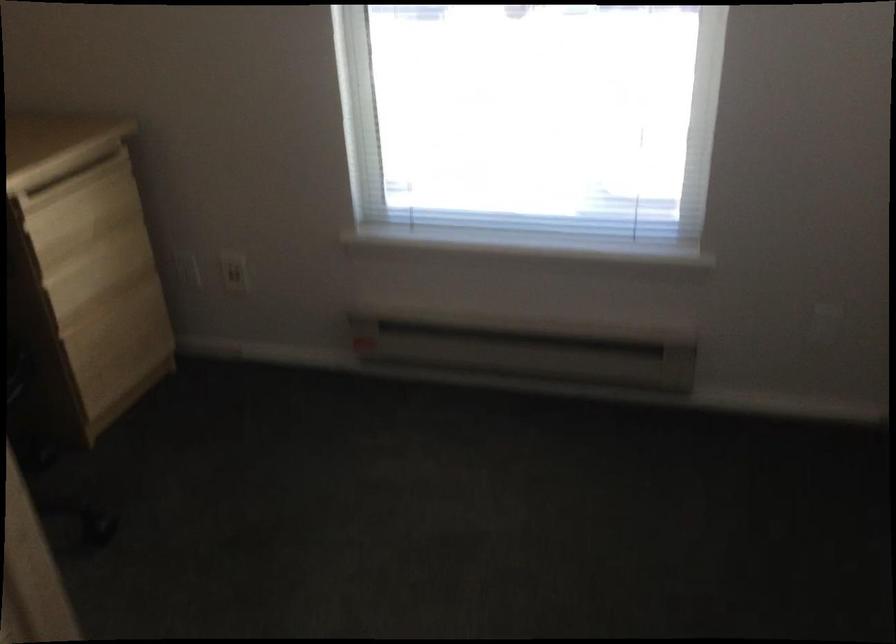
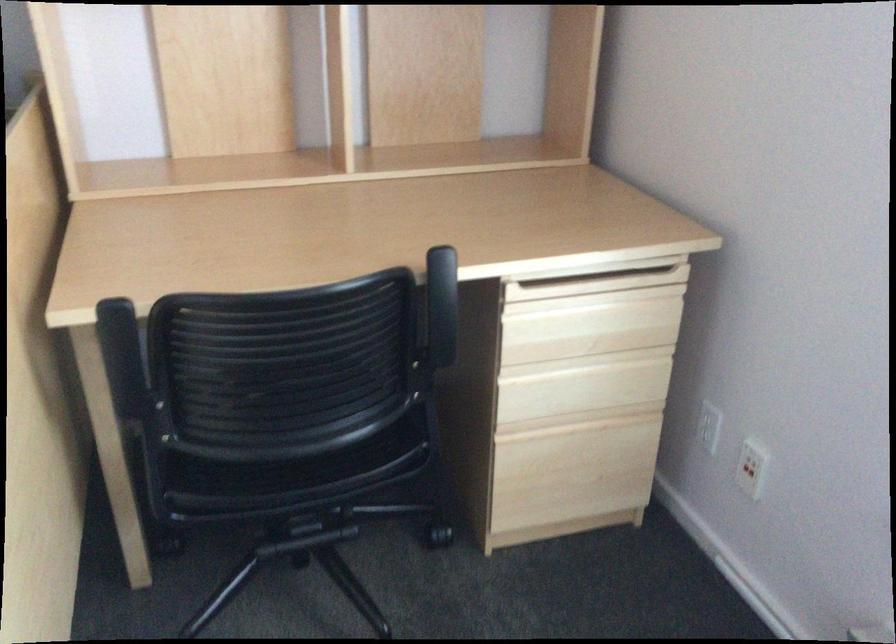
Where in the second image is the point corresponding to [124,337] from the first image?

(574, 465)